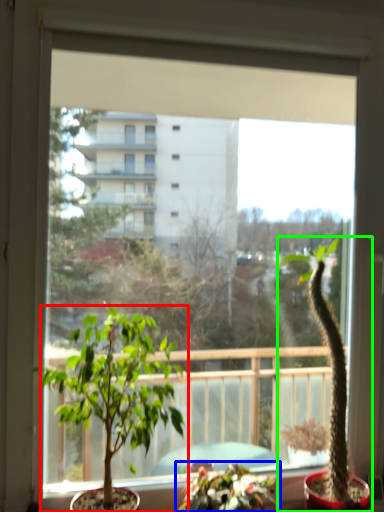
Question: Which object is the farthest from houseplant (highlighted by a red box)? Choose among these: houseplant (highlighted by a blue box) or houseplant (highlighted by a green box).

Choices:
 (A) houseplant
 (B) houseplant

Answer: (B)